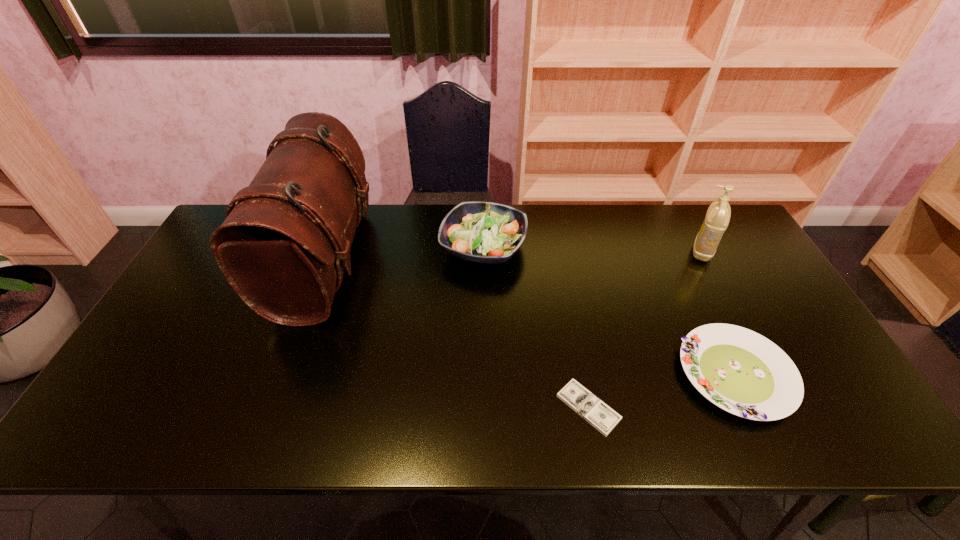
At what (x,y) coordinates should I click in order to perform the action: click on vacant area situated 0.360m on the left of the second tallest object. Please return your answer as a coordinate pair (x, y). The height and width of the screenshot is (540, 960). Looking at the image, I should click on (573, 251).

Locate an element on the screen. free space located on the front of the second object from left to right is located at coordinates (484, 343).

Image resolution: width=960 pixels, height=540 pixels. What are the coordinates of `blank space located on the back of the shorter salad plate` in the screenshot? It's located at (673, 242).

Identify the location of vacant region located 0.260m on the back of the third object from left to right. (568, 301).

You are a GUI agent. You are given a task and a screenshot of the screen. Output one action in this format:
    pyautogui.click(x=<x>, y=<y>)
    Task: Click on the satchel located at the far edge
    
    Given the screenshot: What is the action you would take?
    pyautogui.click(x=282, y=247)

Where is `detergent at the far edge`? The height and width of the screenshot is (540, 960). detergent at the far edge is located at coordinates (718, 215).

Image resolution: width=960 pixels, height=540 pixels. Find the location of `salad plate located in the far edge section of the desktop`. salad plate located in the far edge section of the desktop is located at coordinates (483, 232).

You are a GUI agent. You are given a task and a screenshot of the screen. Output one action in this format:
    pyautogui.click(x=<x>, y=<y>)
    Task: Click on the salad plate situated at the near edge
    The height and width of the screenshot is (540, 960).
    Given the screenshot: What is the action you would take?
    pyautogui.click(x=742, y=372)

Where is `dollar that is at the near edge`? dollar that is at the near edge is located at coordinates (602, 417).

This screenshot has width=960, height=540. I want to click on detergent at the right edge, so click(718, 215).